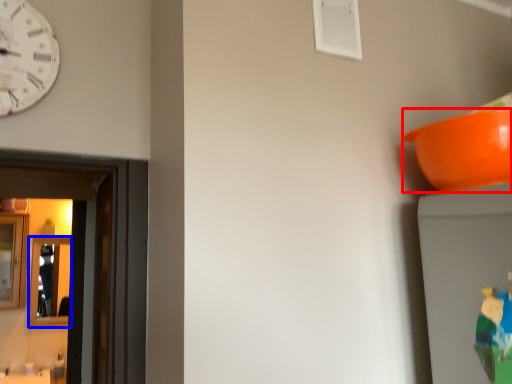
Question: Among these objects, which one is nearest to the camera, bowl (highlighted by a red box) or mirror (highlighted by a blue box)?

Choices:
 (A) bowl
 (B) mirror

Answer: (A)